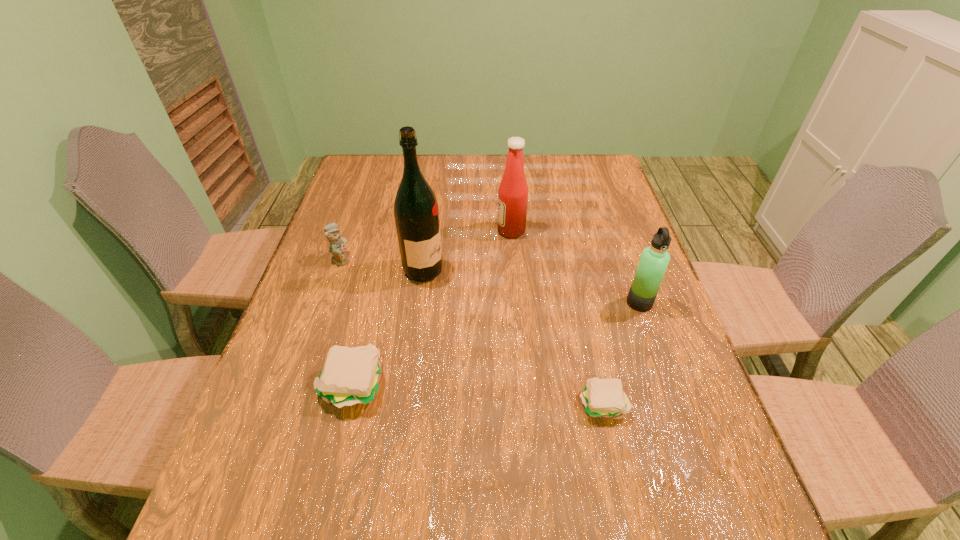
This screenshot has height=540, width=960. Identify the location of the rightmost object. (654, 260).

The image size is (960, 540). I want to click on vacant space situated on the right of the fifth tallest object, so click(x=460, y=385).

Locate an element on the screen. vacant space situated 0.170m on the back of the shortest object is located at coordinates (585, 323).

Locate an element on the screen. free space located 0.340m on the front-facing side of the third object from right to left is located at coordinates (383, 231).

This screenshot has height=540, width=960. Find the location of `blank space located 0.090m on the front-facing side of the third object from right to left`. blank space located 0.090m on the front-facing side of the third object from right to left is located at coordinates (467, 231).

The image size is (960, 540). In order to click on free location located on the front-facing side of the third object from right to left in this screenshot , I will do `click(376, 231)`.

At what (x,y) coordinates should I click in order to perform the action: click on free region located 0.100m on the front-facing side of the teddy bear. Please return your answer as a coordinate pair (x, y). The image size is (960, 540). Looking at the image, I should click on (387, 259).

Locate an element on the screen. The height and width of the screenshot is (540, 960). blank space located 0.240m on the front-facing side of the tallest object is located at coordinates (531, 271).

This screenshot has height=540, width=960. I want to click on free space located 0.060m on the left of the third tallest object, so click(x=603, y=302).

Identify the location of patty at the left edge. (353, 375).